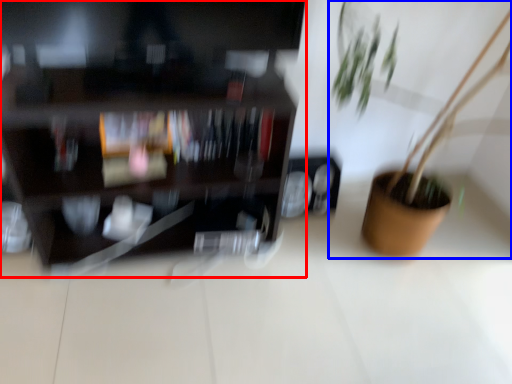
Question: Which of the following is the farthest to the observer, shelf (highlighted by a red box) or houseplant (highlighted by a blue box)?

Choices:
 (A) shelf
 (B) houseplant

Answer: (A)